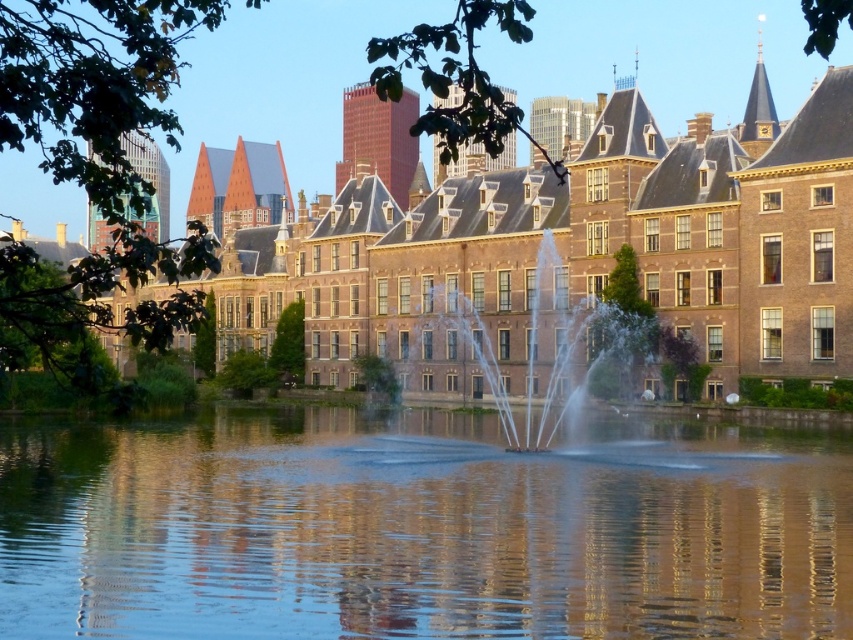
You are an architect evaluating the layout of the historic building and its surroundings. You notice the transparent water at center and the clear water jets at center. Which of these two elements has a greater width in the image?

The transparent water at center has a greater width than the clear water jets at center according to the description provided.

You are an architect evaluating the design of the scene. Based on the image, which object is taller between the transparent water at center and the brown brick building at center?

The brown brick building at center is taller than the transparent water at center.